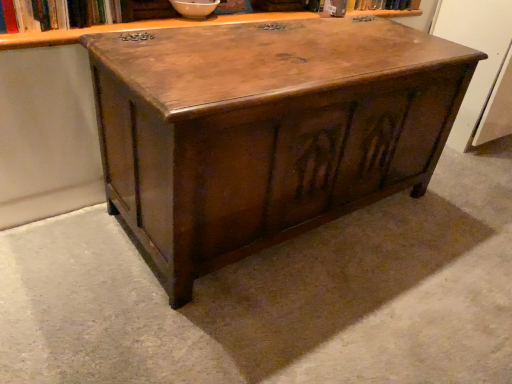
Locate an element on the screen. shiny brown wood chest at center is located at coordinates click(265, 130).

Describe the element at coordinates (265, 130) in the screenshot. I see `shiny brown wood chest at center` at that location.

Locate an element on the screen. The image size is (512, 384). shiny brown wood chest at center is located at coordinates (265, 130).